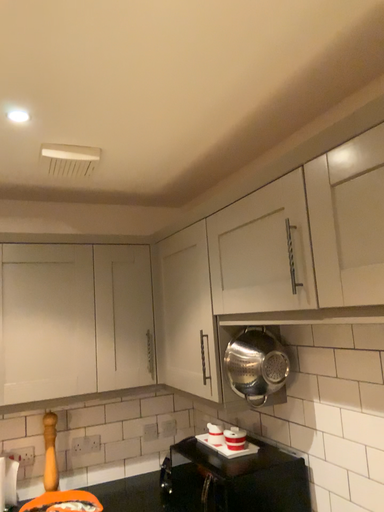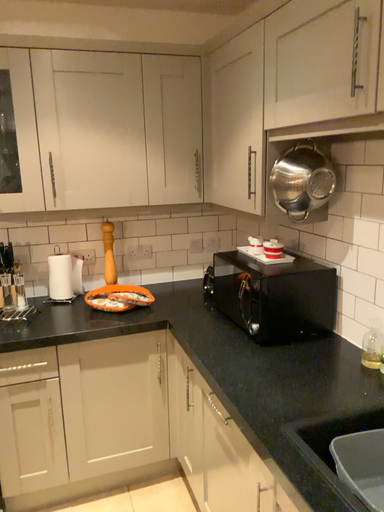
Question: How did the camera likely rotate when shooting the video?

Choices:
 (A) rotated upward
 (B) rotated downward

Answer: (B)